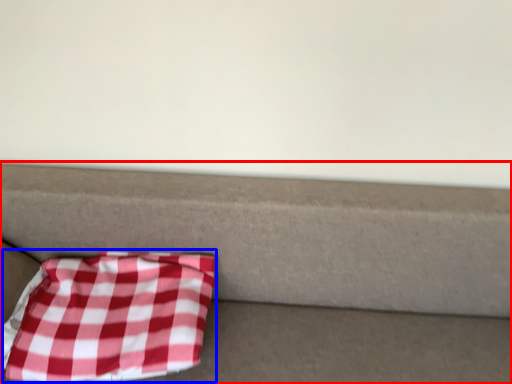
Question: Which point is closer to the camera, furniture (highlighted by a red box) or blanket (highlighted by a blue box)?

Choices:
 (A) furniture
 (B) blanket

Answer: (A)